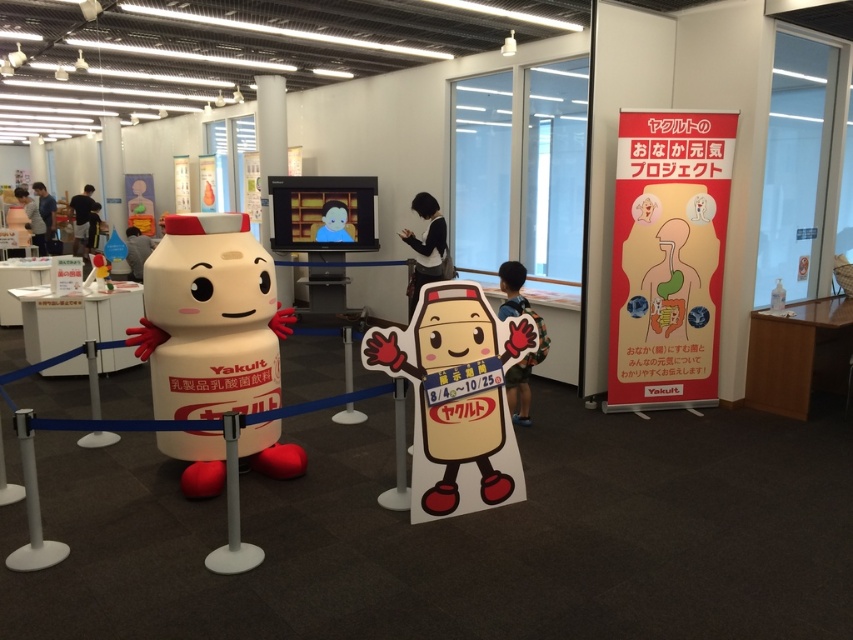
You are a child visiting the exhibition and want to place both the white matte plastic toy at center and the white cardboard mascot at center into a rectangular box. The box can only fit items that are narrower than 30 centimeters. Which item is more likely to fit inside the box?

The white cardboard mascot at center is narrower than the white matte plastic toy at center. Since the box can only fit items narrower than 30 centimeters, the white cardboard mascot at center has a better chance of fitting inside the box compared to the white matte plastic toy at center.

Based on the photo, you are standing in the exhibition space and want to locate the red paper banner at right. According to the coordinates provided, where exactly is it located?

The red paper banner at right is located at coordinates point (x=668, y=257).